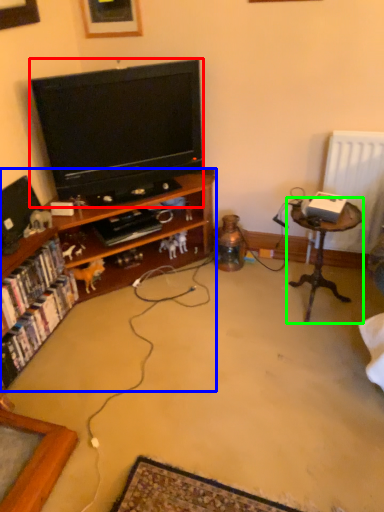
Question: Which is nearer to the television (highlighted by a red box)? cabinetry (highlighted by a blue box) or table (highlighted by a green box).

Choices:
 (A) cabinetry
 (B) table

Answer: (A)